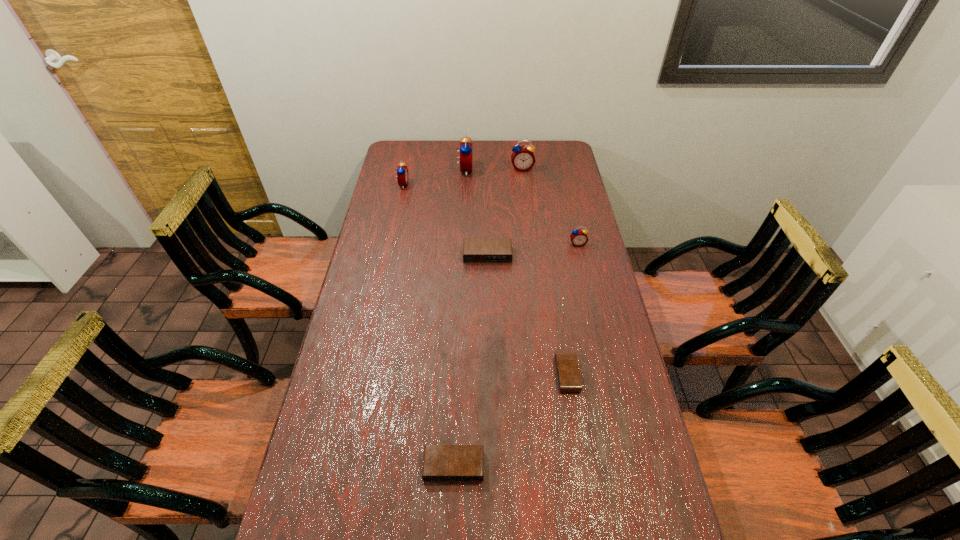
What are the coordinates of `vacant position located on the front face of the rightmost black alarm clock` in the screenshot? It's located at (434, 375).

Where is `vacant space located on the front face of the rightmost black alarm clock`? This screenshot has height=540, width=960. vacant space located on the front face of the rightmost black alarm clock is located at coordinates (516, 375).

At what (x,y) coordinates should I click in order to perform the action: click on free space located 0.260m on the front face of the rightmost black alarm clock. Please return your answer as a coordinate pair (x, y). Image resolution: width=960 pixels, height=540 pixels. Looking at the image, I should click on (468, 375).

Where is `object located at the left edge`? object located at the left edge is located at coordinates (402, 171).

At what (x,y) coordinates should I click in order to perform the action: click on vacant space at the far edge. Please return your answer as a coordinate pair (x, y). The width and height of the screenshot is (960, 540). Looking at the image, I should click on (426, 155).

Locate an element on the screen. This screenshot has width=960, height=540. vacant position at the left edge of the desktop is located at coordinates click(339, 395).

I want to click on vacant space at the right edge of the desktop, so click(x=589, y=355).

This screenshot has height=540, width=960. What are the coordinates of `free spot at the far left corner of the desktop` in the screenshot? It's located at (423, 144).

The height and width of the screenshot is (540, 960). I want to click on vacant area between the second shortest alarm clock and the smallest red alarm clock, so click(516, 355).

Where is `free spot between the shortest alarm clock and the nearest black alarm clock`? This screenshot has height=540, width=960. free spot between the shortest alarm clock and the nearest black alarm clock is located at coordinates (511, 421).